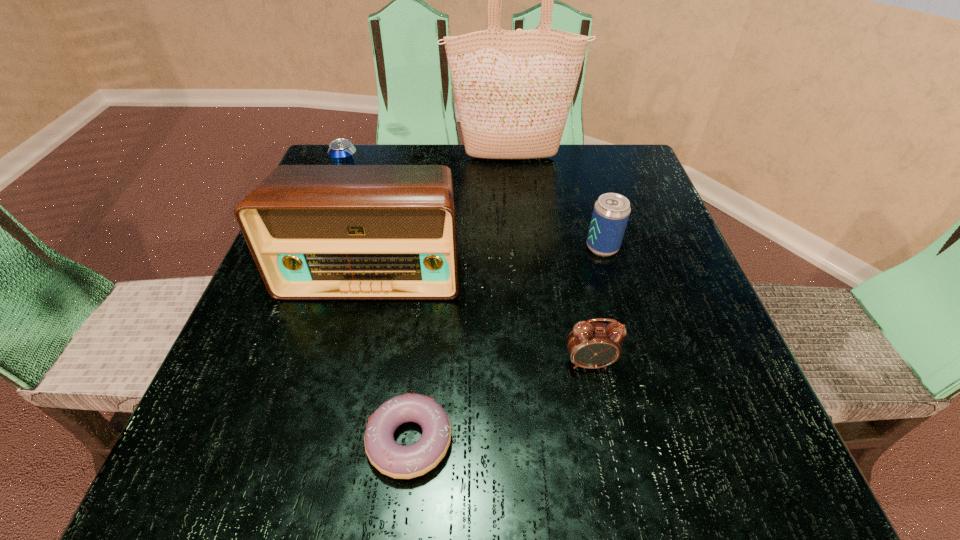
You are a GUI agent. You are given a task and a screenshot of the screen. Output one action in this format:
    pyautogui.click(x=<x>, y=<y>)
    Task: Click on the free point located on the front-facing side of the radio receiver
    This screenshot has width=960, height=540.
    Given the screenshot: What is the action you would take?
    pyautogui.click(x=346, y=386)

You are a GUI agent. You are given a task and a screenshot of the screen. Output one action in this format:
    pyautogui.click(x=<x>, y=<y>)
    Task: Click on the vacant area situated 0.310m on the front of the farther beer can
    The width and height of the screenshot is (960, 540).
    Given the screenshot: What is the action you would take?
    pyautogui.click(x=310, y=304)

At what (x,y) coordinates should I click in order to perform the action: click on vacant area located on the front of the nearer beer can. Please return your answer as a coordinate pair (x, y). The height and width of the screenshot is (540, 960). Looking at the image, I should click on (652, 420).

Identify the location of free point located on the face of the second nearest object. [x=611, y=469].

Locate an element on the screen. free space located on the back of the doughnut is located at coordinates (423, 323).

Image resolution: width=960 pixels, height=540 pixels. Identify the location of shopping bag positioned at the far edge. (513, 88).

Locate an element on the screen. The height and width of the screenshot is (540, 960). beer can that is at the far edge is located at coordinates (341, 151).

You are a GUI agent. You are given a task and a screenshot of the screen. Output one action in this format:
    pyautogui.click(x=<x>, y=<y>)
    Task: Click on the object that is at the near edge
    
    Given the screenshot: What is the action you would take?
    pyautogui.click(x=398, y=461)

I want to click on radio receiver located at the left edge, so click(x=316, y=232).

The width and height of the screenshot is (960, 540). Find the location of `beer can that is at the left edge`. beer can that is at the left edge is located at coordinates (341, 151).